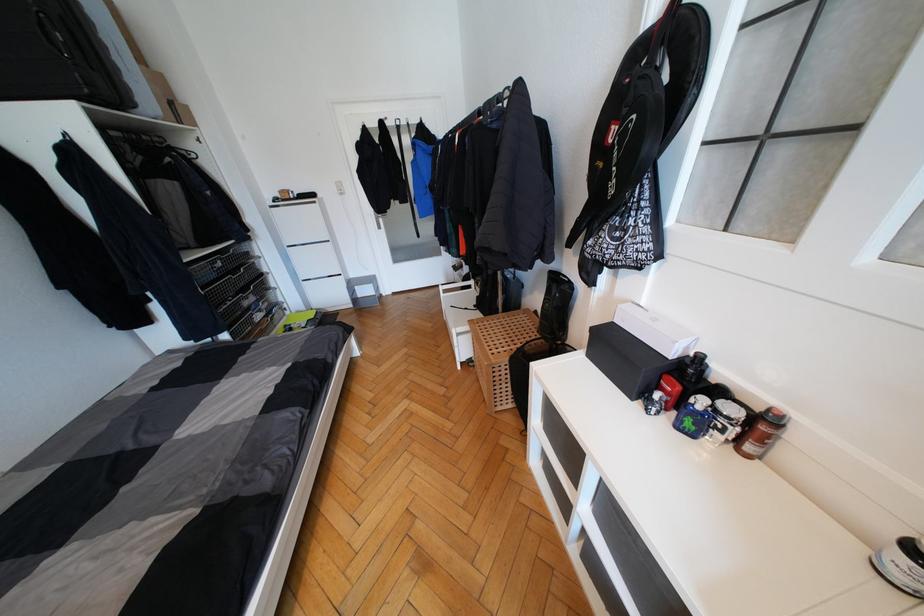
Describe the element at coordinates (643, 108) in the screenshot. I see `the black backpack strap` at that location.